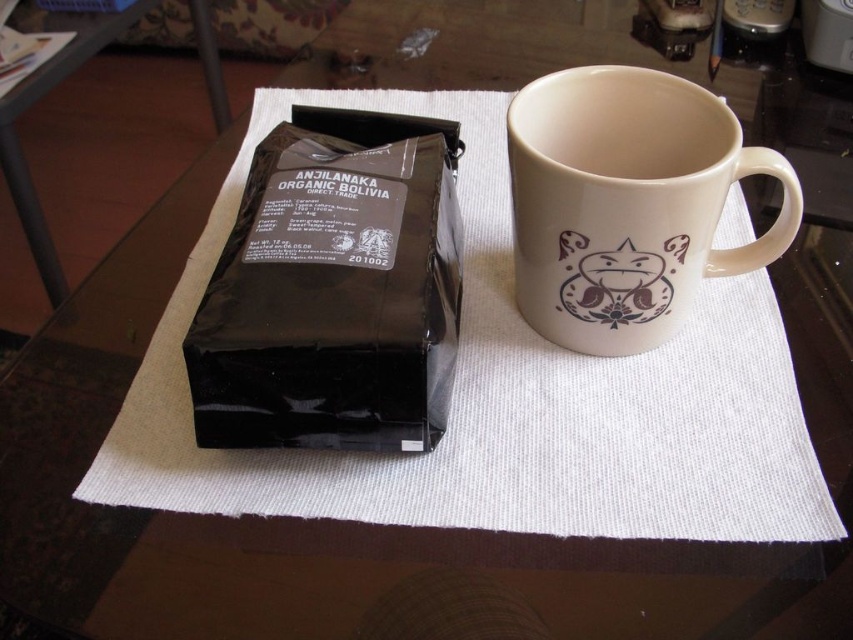
You are a barista preparing a coffee order. You need to place a customer order note on the table so it can be seen clearly from above. Where should you place the note to avoid covering either the black matte bag at left or the matte ceramic mug at upper right?

Place the note between the black matte bag at left and the matte ceramic mug at upper right since the black matte bag at left is in front of the matte ceramic mug at upper right, creating space behind the bag or in front of the mug where the note can be placed without obstruction.

You are organizing items on a dark wooden table. You have a black matte bag at left and a matte ceramic mug at upper right. Based on their positions, which item is closer to the right edge of the table?

The matte ceramic mug at upper right is closer to the right edge of the table since it is positioned to the upper right relative to the black matte bag at left.

You are standing at the edge of the table looking towards the center. Which of the two points, point [367,432] or point [550,211], is closer to you?

Point [550,211] is closer to you because it is behind point [367,432], which is in front of it.